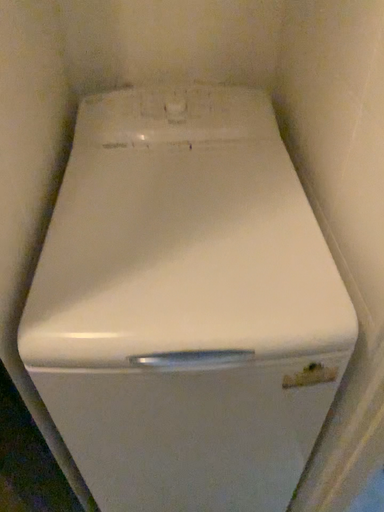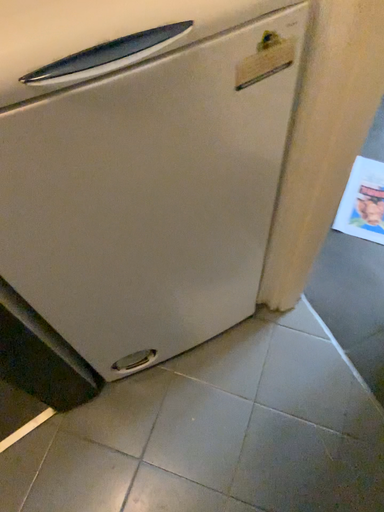
Question: How did the camera likely rotate when shooting the video?

Choices:
 (A) rotated upward
 (B) rotated downward

Answer: (B)